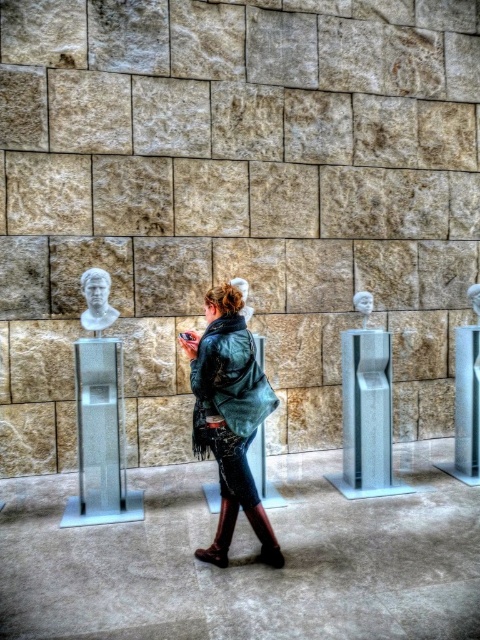
Question: Is green leather jacket at center bigger than clear glass pillar at center?

Choices:
 (A) yes
 (B) no

Answer: (A)

Question: Which object is the closest to the metallic polished column at center?

Choices:
 (A) green leather jacket at center
 (B) brown leather boot at lower center
 (C) white marble bust at center

Answer: (C)

Question: Which point appears closest to the camera in this image?

Choices:
 (A) (214, 428)
 (B) (262, 524)
 (C) (81, 428)
 (D) (88, 285)

Answer: (A)

Question: Is metallic polished column at center wider than clear glass pillar at center?

Choices:
 (A) no
 (B) yes

Answer: (B)

Question: Does leather jacket at center appear over metallic polished column at center?

Choices:
 (A) yes
 (B) no

Answer: (A)

Question: Which of the following is the closest to the observer?

Choices:
 (A) metallic polished column at center
 (B) clear glass pedestal at center
 (C) white marble bust at center

Answer: (A)